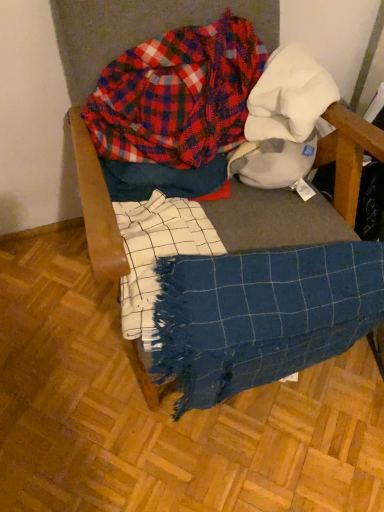
What are the coordinates of `blue woven blanket at lower right` in the screenshot? It's located at [261, 315].

The image size is (384, 512). I want to click on plaid flannel shirt at upper center, so click(177, 95).

The width and height of the screenshot is (384, 512). I want to click on blanket located behind the blue woven blanket at center, so click(261, 315).

From the picture: Which is behind, blue woven blanket at center or blue woven blanket at lower right?

Positioned behind is blue woven blanket at lower right.

Is blue woven blanket at center located outside blue woven blanket at lower right?

Yes, blue woven blanket at center is located beyond the bounds of blue woven blanket at lower right.

Would you say blue woven blanket at center is part of plaid flannel shirt at upper center's contents?

No, blue woven blanket at center is not a part of plaid flannel shirt at upper center.

Is the surface of plaid flannel shirt at upper center in direct contact with blue woven blanket at center?

No, plaid flannel shirt at upper center is not touching blue woven blanket at center.

How much distance is there between plaid flannel shirt at upper center and blue woven blanket at center?

They are 8.87 inches apart.

What's the angular difference between plaid flannel shirt at upper center and blue woven blanket at center's facing directions?

There is a 4.07-degree angle between the facing directions of plaid flannel shirt at upper center and blue woven blanket at center.

Based on the photo, between blue woven blanket at center and plaid flannel shirt at upper center, which one has smaller size?

plaid flannel shirt at upper center is smaller.

Is blue woven blanket at center wider or thinner than plaid flannel shirt at upper center?

Considering their sizes, blue woven blanket at center looks broader than plaid flannel shirt at upper center.

Is blue woven blanket at center shorter than plaid flannel shirt at upper center?

No.

From their relative heights in the image, would you say blue woven blanket at lower right is taller or shorter than plaid flannel shirt at upper center?

blue woven blanket at lower right is taller than plaid flannel shirt at upper center.

Considering the relative positions of blue woven blanket at lower right and plaid flannel shirt at upper center in the image provided, is blue woven blanket at lower right to the left or to the right of plaid flannel shirt at upper center?

blue woven blanket at lower right is positioned on plaid flannel shirt at upper center's right side.

Is blue woven blanket at lower right wider than plaid flannel shirt at upper center?

Yes.

Which object is closer to the camera, blue woven blanket at lower right or plaid flannel shirt at upper center?

blue woven blanket at lower right is in front.

Is blue woven blanket at lower right facing away from blue woven blanket at center?

Correct, blue woven blanket at lower right is looking away from blue woven blanket at center.

Considering the positions of objects blue woven blanket at lower right and blue woven blanket at center in the image provided, who is more to the right, blue woven blanket at lower right or blue woven blanket at center?

blue woven blanket at lower right is more to the right.

In terms of size, does blue woven blanket at lower right appear bigger or smaller than blue woven blanket at center?

blue woven blanket at lower right is smaller than blue woven blanket at center.

Is blue woven blanket at lower right positioned behind blue woven blanket at center?

Yes, the depth of blue woven blanket at lower right is greater than that of blue woven blanket at center.

Is plaid flannel shirt at upper center facing away from blue woven blanket at lower right?

No.

Between plaid flannel shirt at upper center and blue woven blanket at lower right, which one is positioned in front?

blue woven blanket at lower right is closer to the camera.

Which is more to the left, plaid flannel shirt at upper center or blue woven blanket at lower right?

From the viewer's perspective, plaid flannel shirt at upper center appears more on the left side.

This screenshot has width=384, height=512. Identify the location of furniture above the blue woven blanket at lower right (from the image's perspective). (96, 206).

You are a GUI agent. You are given a task and a screenshot of the screen. Output one action in this format:
    pyautogui.click(x=<x>, y=<y>)
    Task: Click on the furniture below the plaid flannel shirt at upper center (from a real-world perspective)
    This screenshot has width=384, height=512.
    Given the screenshot: What is the action you would take?
    pyautogui.click(x=96, y=206)

In the scene shown: From the image, which object appears to be nearer to plaid flannel shirt at upper center, blue woven blanket at lower right or blue woven blanket at center?

blue woven blanket at center lies closer to plaid flannel shirt at upper center than the other object.

Considering their positions, is blue woven blanket at center positioned further to blue woven blanket at lower right than plaid flannel shirt at upper center?

plaid flannel shirt at upper center is further to blue woven blanket at lower right.

Which object lies further to the anchor point blue woven blanket at center, plaid flannel shirt at upper center or blue woven blanket at lower right?

blue woven blanket at lower right is further to blue woven blanket at center.

Based on the photo, looking at the image, which one is located closer to plaid flannel shirt at upper center, blue woven blanket at center or blue woven blanket at lower right?

Among the two, blue woven blanket at center is located nearer to plaid flannel shirt at upper center.

Estimate the real-world distances between objects in this image. Which object is further from blue woven blanket at lower right, plaid flannel shirt at upper center or blue woven blanket at center?

Among the two, plaid flannel shirt at upper center is located further to blue woven blanket at lower right.

Looking at the image, which one is located further to blue woven blanket at center, blue woven blanket at lower right or plaid flannel shirt at upper center?

blue woven blanket at lower right is further to blue woven blanket at center.

Find the location of a particular element. Image resolution: width=384 pixels, height=512 pixels. furniture between plaid flannel shirt at upper center and blue woven blanket at lower right in the vertical direction is located at coordinates (96, 206).